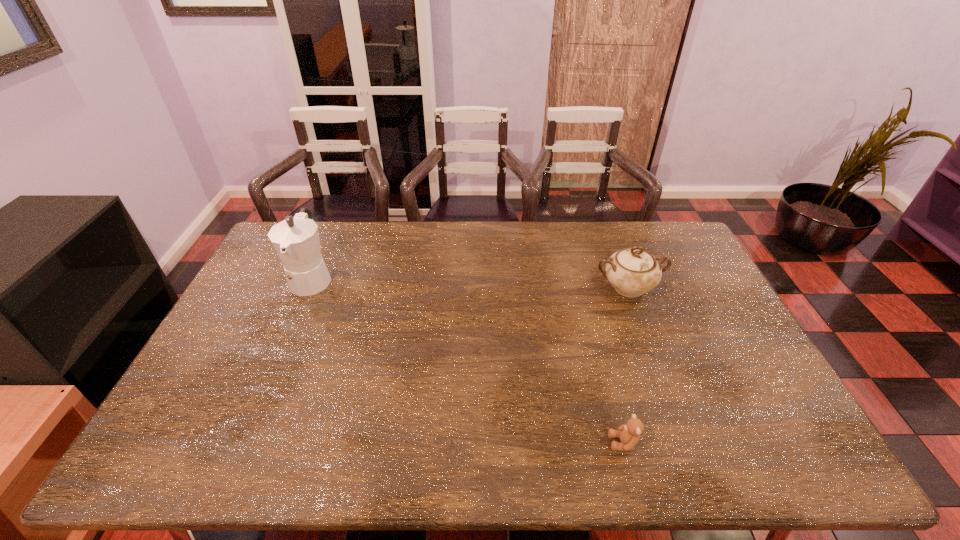
Where is `vacant space at the near right corner of the desktop`? vacant space at the near right corner of the desktop is located at coordinates click(x=748, y=441).

Locate an element on the screen. The width and height of the screenshot is (960, 540). blank region between the second tallest object and the leftmost object is located at coordinates (470, 283).

This screenshot has height=540, width=960. Identify the location of free point between the second tallest object and the tallest object. (470, 283).

This screenshot has height=540, width=960. I want to click on free spot between the chinaware and the leftmost object, so pyautogui.click(x=470, y=283).

Find the location of a particular element. The image size is (960, 540). vacant region between the shortest object and the rightmost object is located at coordinates (626, 365).

The image size is (960, 540). I want to click on vacant space that is in between the tallest object and the rightmost object, so click(470, 283).

The height and width of the screenshot is (540, 960). I want to click on empty location between the leftmost object and the chinaware, so click(x=470, y=283).

Where is `unoccupied position between the second object from left to right and the chinaware`? The width and height of the screenshot is (960, 540). unoccupied position between the second object from left to right and the chinaware is located at coordinates (626, 365).

The width and height of the screenshot is (960, 540). Find the location of `free space between the tallest object and the shortest object`. free space between the tallest object and the shortest object is located at coordinates (468, 360).

Find the location of a particular element. vacant point located between the tallest object and the chinaware is located at coordinates (470, 283).